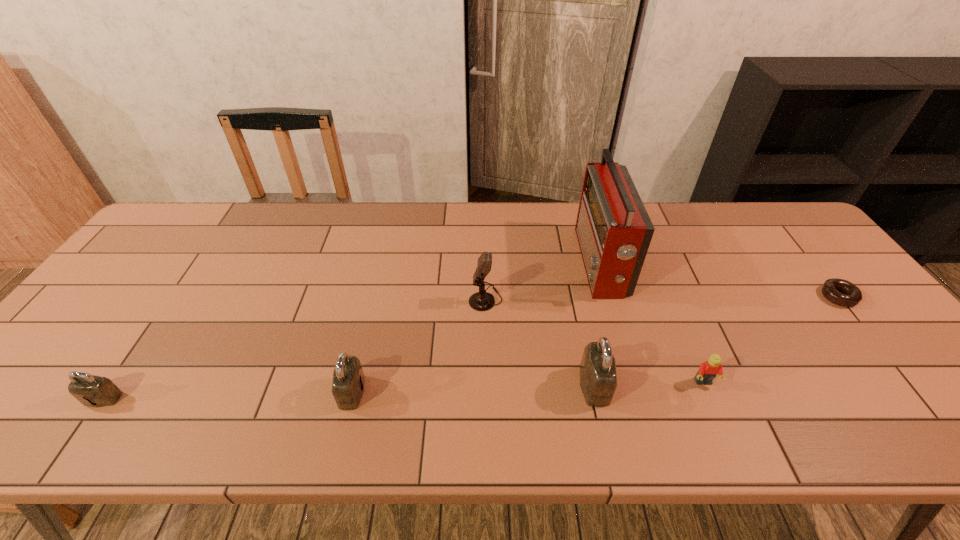
You are a GUI agent. You are given a task and a screenshot of the screen. Output one action in this format:
    pyautogui.click(x=<x>, y=<y>)
    Task: Click on the vacant place for an extra padlock on the right
    
    Given the screenshot: What is the action you would take?
    pyautogui.click(x=831, y=379)